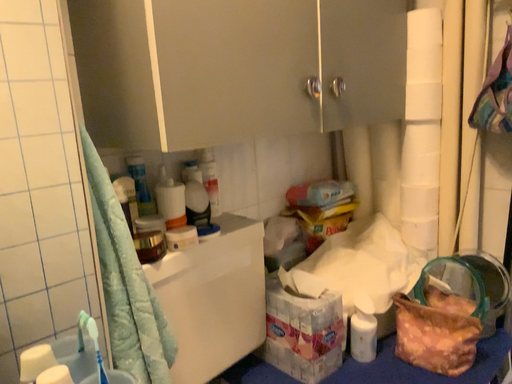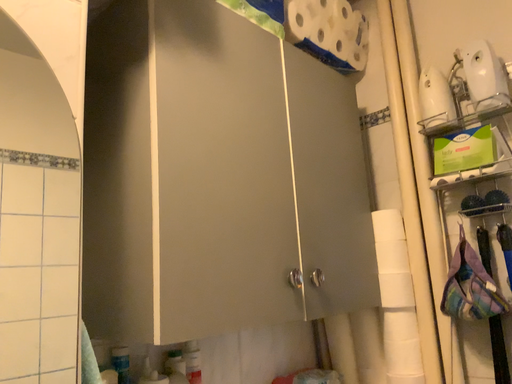
Question: Which way did the camera rotate in the video?

Choices:
 (A) rotated upward
 (B) rotated downward

Answer: (A)